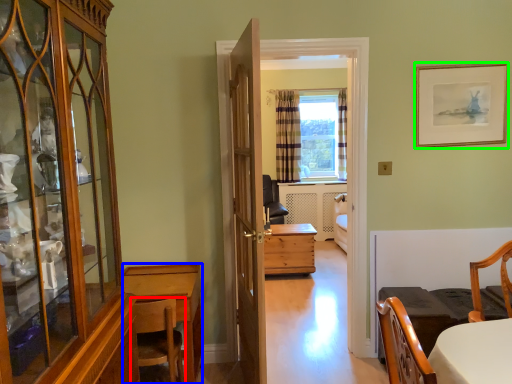
Question: Which object is positioned closest to chair (highlighted by a red box)? Select from desk (highlighted by a blue box) and picture frame (highlighted by a green box).

Choices:
 (A) desk
 (B) picture frame

Answer: (A)